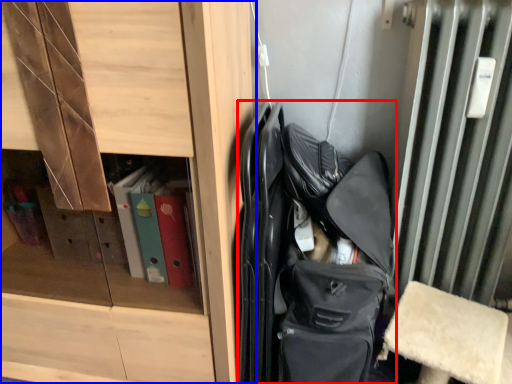
Question: Which object appears farthest to the camera in this image, bag (highlighted by a red box) or cabinetry (highlighted by a blue box)?

Choices:
 (A) bag
 (B) cabinetry

Answer: (A)